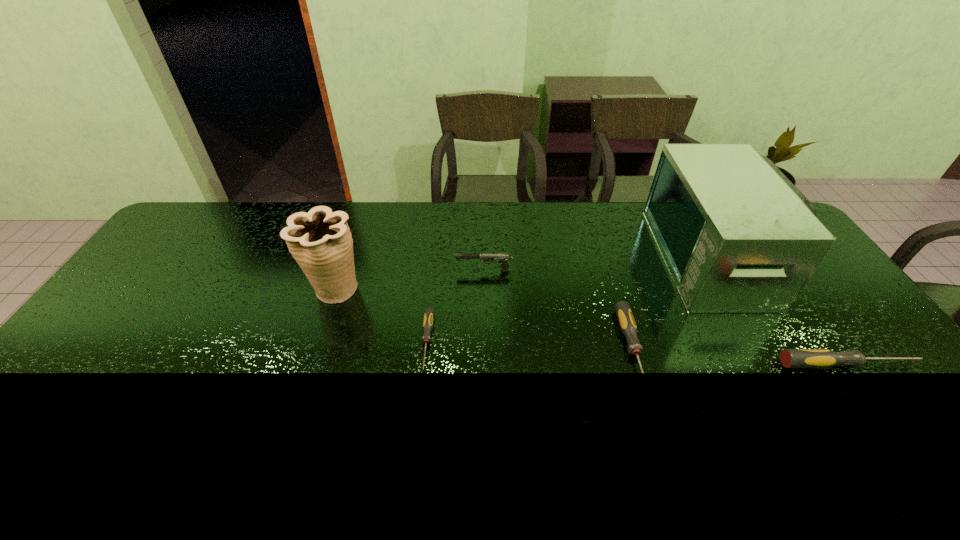
You are a GUI agent. You are given a task and a screenshot of the screen. Output one action in this format:
    pyautogui.click(x=<x>, y=<y>)
    Task: Click on the free space between the shortest screwdriver and the fifth tallest object
    This screenshot has height=540, width=960.
    Given the screenshot: What is the action you would take?
    pyautogui.click(x=530, y=347)

What are the coordinates of `vacant area that lies between the third tallest object and the urn` in the screenshot? It's located at (410, 279).

Locate an element on the screen. vacant area that lies between the urn and the microwave oven is located at coordinates (527, 273).

At what (x,y) coordinates should I click in order to perform the action: click on free space between the shortest screwdriver and the microwave oven. Please return your answer as a coordinate pair (x, y). The height and width of the screenshot is (540, 960). Looking at the image, I should click on (572, 299).

This screenshot has width=960, height=540. In order to click on free space between the microwave oven and the second screwdriver from right to left in this screenshot , I will do `click(675, 305)`.

Where is `object that stands as the closest to the rightmost screwdriver`? object that stands as the closest to the rightmost screwdriver is located at coordinates (737, 236).

In order to click on object that is the third closest to the microwave oven in this screenshot , I will do tap(503, 258).

Locate which screwdriver ranks in proximity to the shortest object. Please provide its 2D coordinates. Your answer should be formatted as a tuple, i.e. [(x, y)], where the tuple contains the x and y coordinates of a point satisfying the conditions above.

[(625, 317)]

Where is `the third closest screwdriver relative to the leftmost object`? The image size is (960, 540). the third closest screwdriver relative to the leftmost object is located at coordinates (790, 358).

The width and height of the screenshot is (960, 540). What are the coordinates of `free spot that satisfies the following two spatial constraints: 1. at the muzzle end of the gun; 2. on the front side of the urn` in the screenshot? It's located at (484, 289).